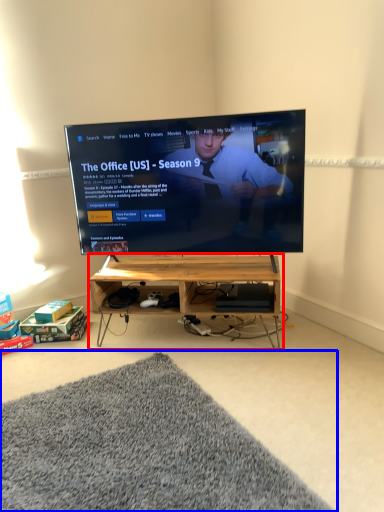
Question: Which object is further to the camera taking this photo, shelf (highlighted by a red box) or mat (highlighted by a blue box)?

Choices:
 (A) shelf
 (B) mat

Answer: (A)